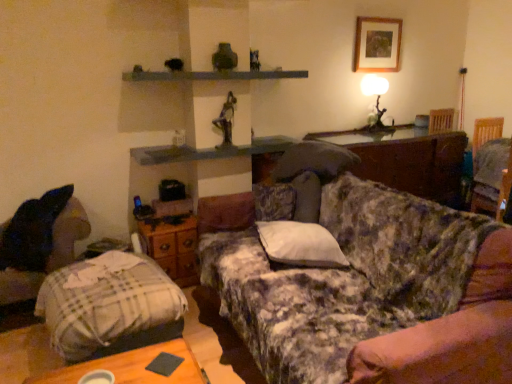
Where is `free spot above plaid fabric bedcover at lower left (from a real-world perspective)`? This screenshot has height=384, width=512. free spot above plaid fabric bedcover at lower left (from a real-world perspective) is located at coordinates (105, 272).